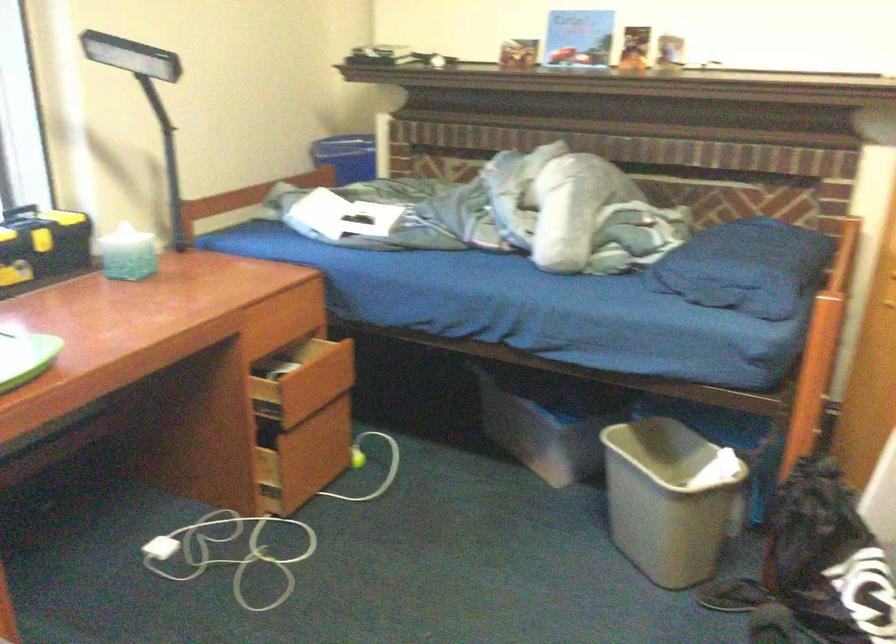
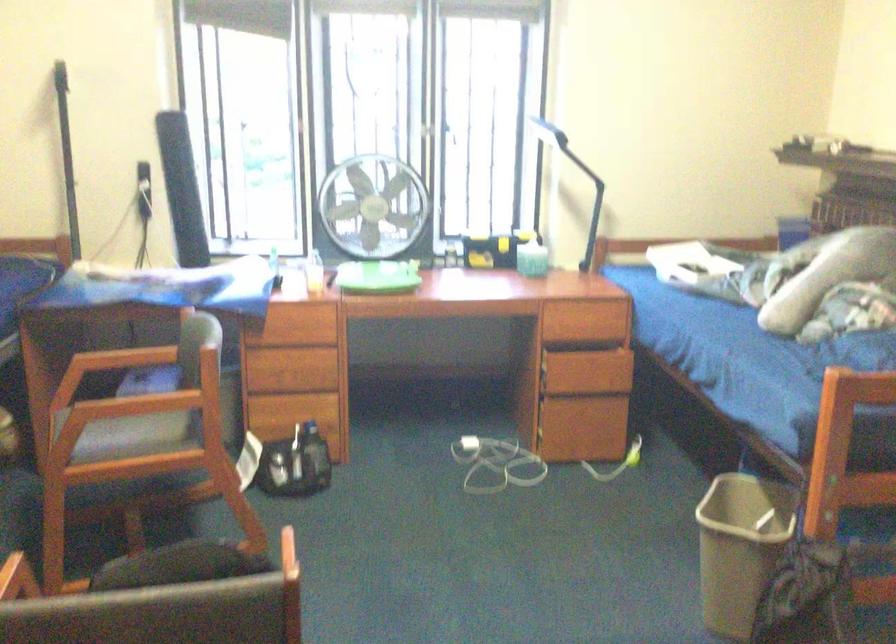
Find the pixel in the second image that matches point (314, 447) in the first image.

(599, 424)